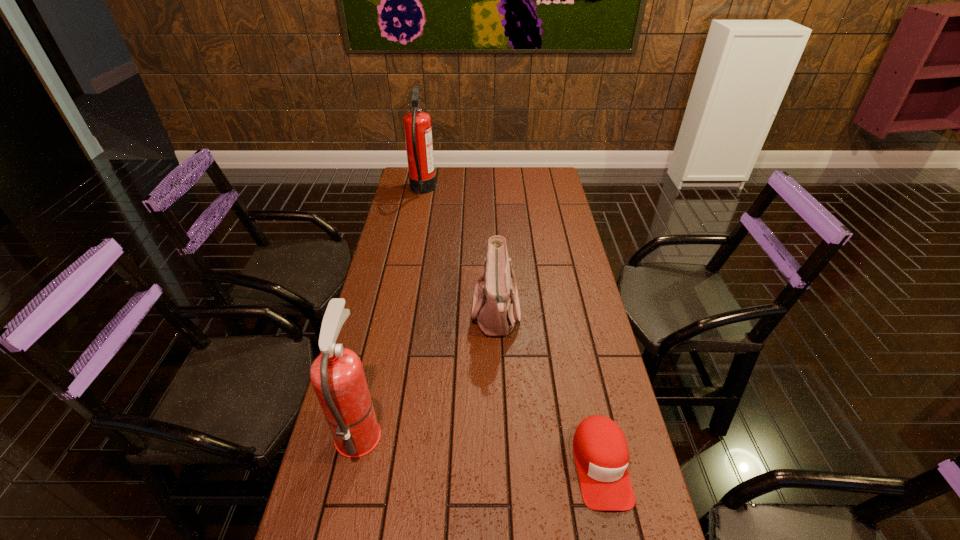
Locate an element on the screen. This screenshot has width=960, height=540. free space located 0.350m on the front pocket of the second farthest object is located at coordinates (365, 314).

The width and height of the screenshot is (960, 540). In order to click on object that is at the far edge in this screenshot , I will do `click(417, 125)`.

Locate an element on the screen. object present at the right edge is located at coordinates (601, 453).

Find the location of a particular element. This screenshot has width=960, height=540. object that is at the far left corner is located at coordinates (417, 125).

Locate an element on the screen. Image resolution: width=960 pixels, height=540 pixels. free location at the far edge is located at coordinates (458, 184).

Where is `vacant region at the left edge of the desktop`? This screenshot has width=960, height=540. vacant region at the left edge of the desktop is located at coordinates (426, 199).

Locate an element on the screen. This screenshot has height=540, width=960. vacant space at the right edge of the desktop is located at coordinates (598, 353).

This screenshot has height=540, width=960. In the image, there is a desktop. Find the location of `free space at the far right corner`. free space at the far right corner is located at coordinates (551, 183).

Locate an element on the screen. empty location between the third object from left to right and the nearer fire extinguisher is located at coordinates (427, 372).

You are a GUI agent. You are given a task and a screenshot of the screen. Output one action in this format:
    pyautogui.click(x=<x>, y=<y>)
    Task: Click on the free spot between the farther fire extinguisher and the third tallest object
    The image size is (960, 540).
    Given the screenshot: What is the action you would take?
    pyautogui.click(x=459, y=252)